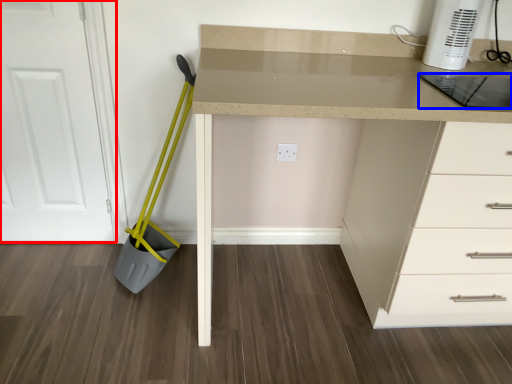
Question: Which of the following is the closest to the observer, door (highlighted by a red box) or kitchen appliance (highlighted by a blue box)?

Choices:
 (A) door
 (B) kitchen appliance

Answer: (B)